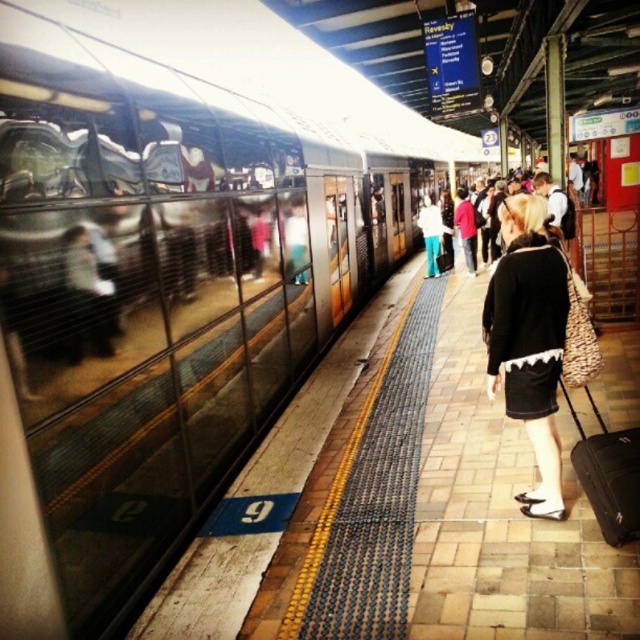
Question: Which of the following is the closest to the observer?

Choices:
 (A) black matte skirt at center
 (B) black fabric suitcase at lower right

Answer: (B)

Question: Can you confirm if black matte skirt at center is thinner than black fabric suitcase at lower right?

Choices:
 (A) no
 (B) yes

Answer: (A)

Question: Among these points, which one is nearest to the camera?

Choices:
 (A) (531, 266)
 (B) (614, 476)

Answer: (B)

Question: In this image, where is black matte skirt at center located relative to black fabric suitcase at lower right?

Choices:
 (A) right
 (B) left

Answer: (B)

Question: In this image, where is black matte skirt at center located relative to black fabric suitcase at lower right?

Choices:
 (A) right
 (B) left

Answer: (B)

Question: Which point is closer to the camera?

Choices:
 (A) (532, 246)
 (B) (636, 451)

Answer: (B)